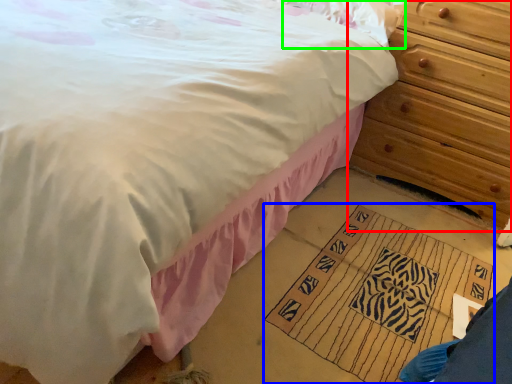
Question: Estimate the real-world distances between objects in this image. Which object is closer to chest of drawers (highlighted by a red box), doormat (highlighted by a blue box) or pillow (highlighted by a green box)?

Choices:
 (A) doormat
 (B) pillow

Answer: (B)